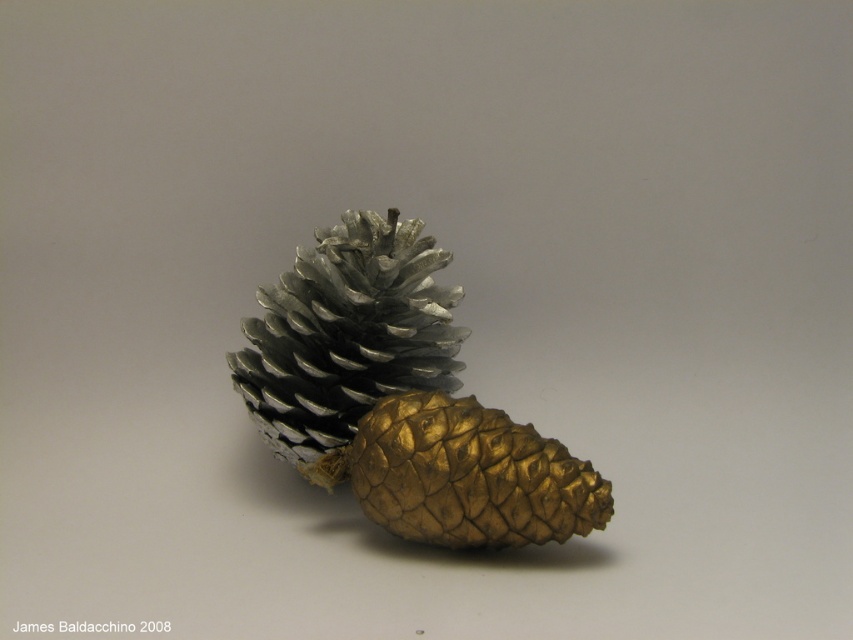
You are an interior designer arranging a display shelf. You have a gold metallic pinecone at center and a metallic silver pine cone at center. If you want to place them vertically side by side, which pinecone should you position at the back to ensure both are fully visible?

The gold metallic pinecone at center is taller than the metallic silver pine cone at center. To ensure both are fully visible when placed vertically side by side, position the shorter metallic silver pine cone at center at the front and the taller gold metallic pinecone at center at the back.

You are an interior designer arranging these two pinecones on a shelf. The gold metallic pinecone at center and the metallic silver pine cone at center need to be placed in a way that the one above the other. Which pinecone should be placed on top to maintain their current spatial relationship?

The gold metallic pinecone at center is positioned under metallic silver pine cone at center, so to maintain their current spatial relationship, the metallic silver pine cone at center should be placed on top of the gold metallic pinecone at center.

You are a collector of miniature items and have a display shelf that can only accommodate items spaced 1.5 inches apart. You see the gold metallic pinecone at center and the metallic silver pine cone at center. Can both pinecones fit on the shelf without overlapping?

The gold metallic pinecone at center and the metallic silver pine cone at center are 1.29 inches apart, which is less than the 1.5 inches required by the display shelf. Therefore, they can fit without overlapping.